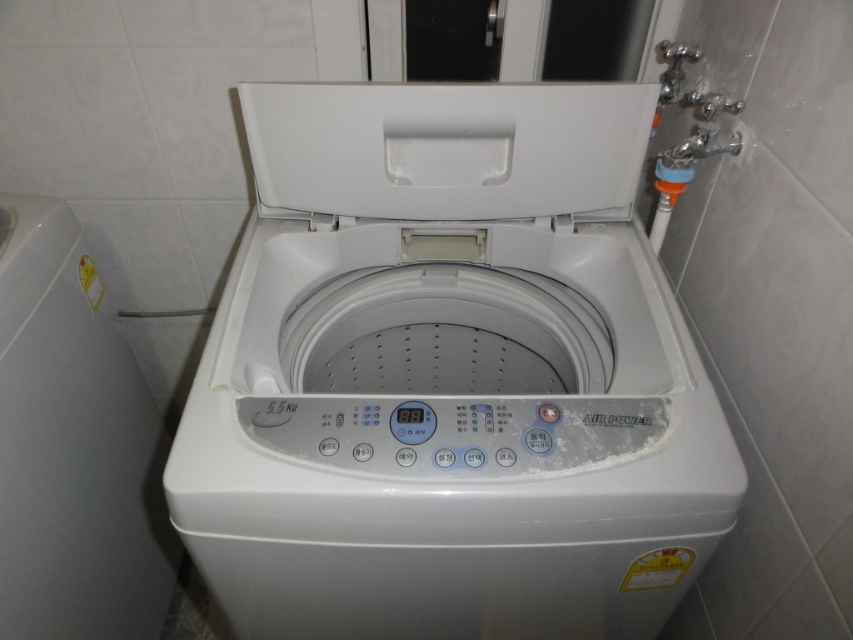
Question: Which object is farther from the camera taking this photo?

Choices:
 (A) white matte lid at center
 (B) white plastic washing machine at lower left

Answer: (A)

Question: Considering the real-world distances, which object is farthest from the white matte lid at center?

Choices:
 (A) white plastic washing machine at lower left
 (B) white plastic washing machine at center

Answer: (A)

Question: Does white plastic washing machine at center have a lesser width compared to white matte lid at center?

Choices:
 (A) yes
 (B) no

Answer: (B)

Question: Can you confirm if white plastic washing machine at center is positioned above white matte lid at center?

Choices:
 (A) yes
 (B) no

Answer: (B)

Question: Can you confirm if white plastic washing machine at lower left is smaller than white matte lid at center?

Choices:
 (A) yes
 (B) no

Answer: (B)

Question: Which point is closer to the camera?

Choices:
 (A) white plastic washing machine at lower left
 (B) white plastic washing machine at center

Answer: (B)